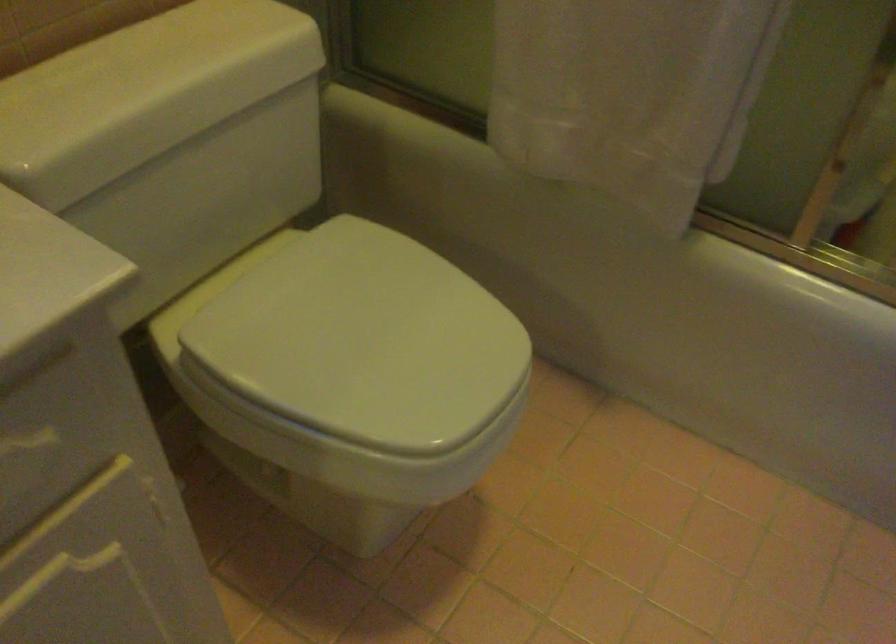
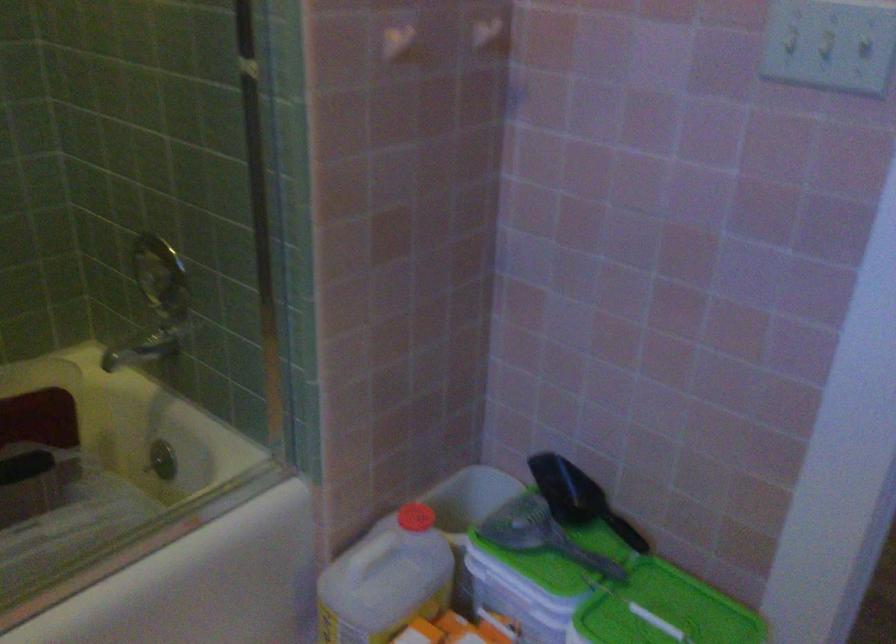
The first image is from the beginning of the video and the second image is from the end. How did the camera likely rotate when shooting the video?

The camera rotated toward right-down.